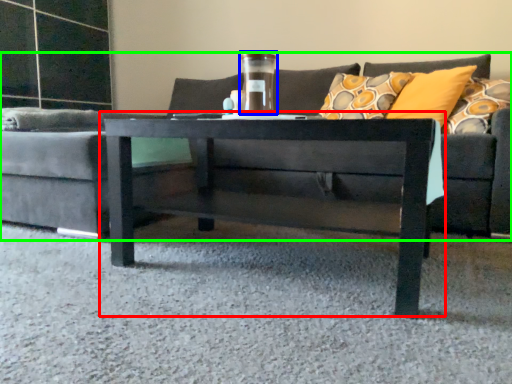
Question: Which object is the closest to the coffee table (highlighted by a red box)? Choose among these: glass vase (highlighted by a blue box) or studio couch (highlighted by a green box).

Choices:
 (A) glass vase
 (B) studio couch

Answer: (A)